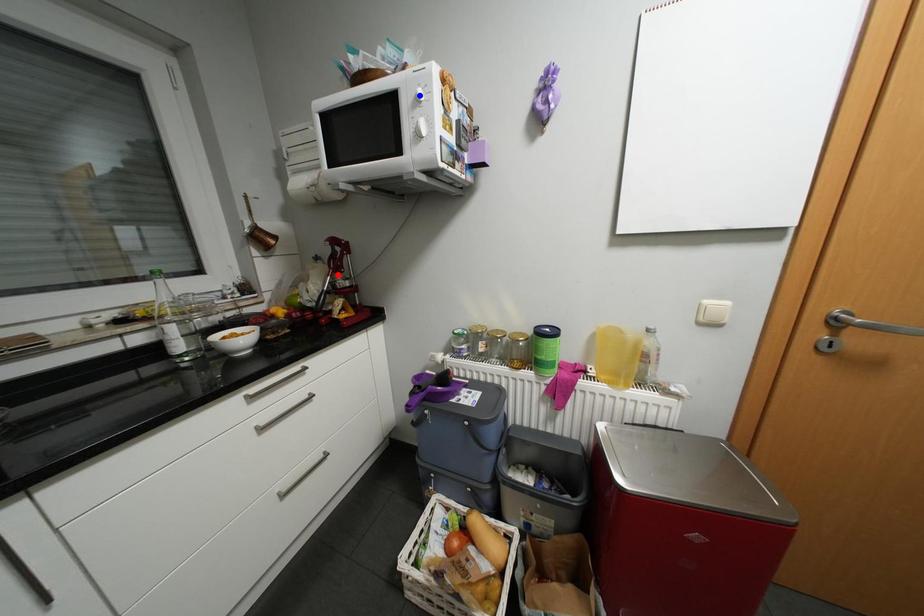
Question: In the image, two points are highlighted. Which point is nearer to the camera? Reply with the corresponding letter.

Choices:
 (A) blue point
 (B) red point

Answer: (A)